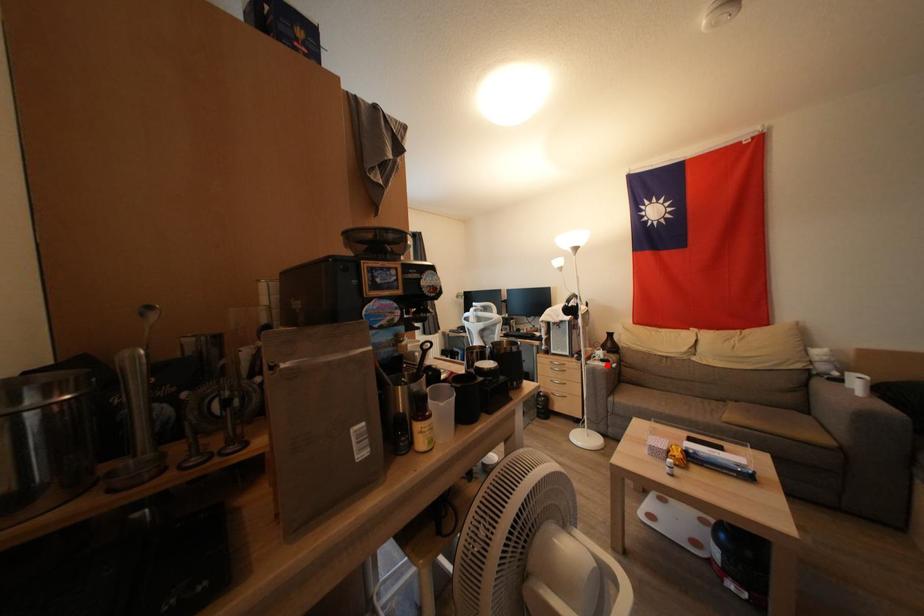
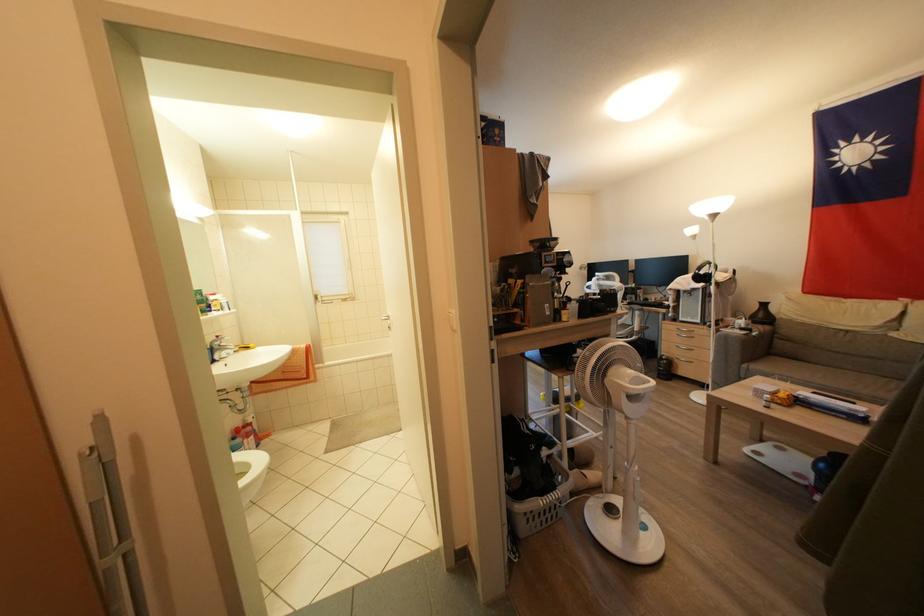
Locate, in the second image, the point that corresponds to the highlighted location in the first image.

(747, 333)